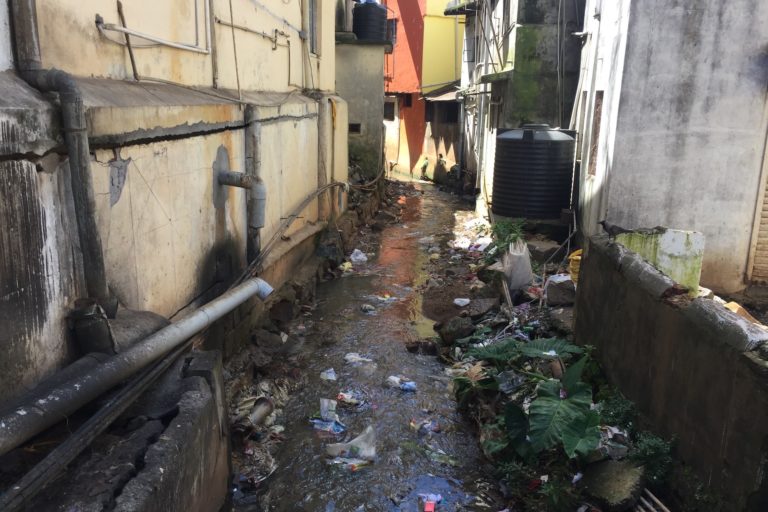
Where is `wall`? wall is located at coordinates (167, 241).